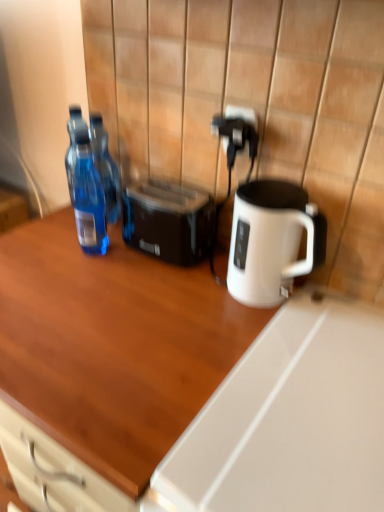
Question: Does wooden desk at center have a lesser height compared to black plastic toaster at center?

Choices:
 (A) no
 (B) yes

Answer: (A)

Question: Is wooden desk at center surrounding black plastic toaster at center?

Choices:
 (A) yes
 (B) no

Answer: (B)

Question: Is wooden desk at center in front of black plastic toaster at center?

Choices:
 (A) no
 (B) yes

Answer: (B)

Question: Is black plastic toaster at center at the back of wooden desk at center?

Choices:
 (A) yes
 (B) no

Answer: (B)

Question: Considering the relative sizes of wooden desk at center and black plastic toaster at center in the image provided, is wooden desk at center wider than black plastic toaster at center?

Choices:
 (A) no
 (B) yes

Answer: (B)

Question: Is point (168, 257) positioned closer to the camera than point (1, 356)?

Choices:
 (A) farther
 (B) closer

Answer: (A)

Question: Is black plastic toaster at center inside or outside of wooden desk at center?

Choices:
 (A) inside
 (B) outside

Answer: (B)

Question: Looking at the image, does black plastic toaster at center seem bigger or smaller compared to wooden desk at center?

Choices:
 (A) big
 (B) small

Answer: (B)

Question: From a real-world perspective, is black plastic toaster at center positioned above or below wooden desk at center?

Choices:
 (A) below
 (B) above

Answer: (B)

Question: Considering the relative positions of transparent plastic bottle at left, the second bottle in the front-to-back sequence, and black plastic toaster at center in the image provided, is transparent plastic bottle at left, the second bottle in the front-to-back sequence, to the left or to the right of black plastic toaster at center?

Choices:
 (A) right
 (B) left

Answer: (B)

Question: In terms of size, does transparent plastic bottle at left, the second bottle in the front-to-back sequence, appear bigger or smaller than black plastic toaster at center?

Choices:
 (A) big
 (B) small

Answer: (B)

Question: From their relative heights in the image, would you say transparent plastic bottle at left, which ranks as the first bottle in back-to-front order, is taller or shorter than black plastic toaster at center?

Choices:
 (A) tall
 (B) short

Answer: (A)

Question: Is transparent plastic bottle at left, which ranks as the first bottle in back-to-front order, in front of or behind black plastic toaster at center in the image?

Choices:
 (A) behind
 (B) front

Answer: (A)

Question: Would you say transparent plastic bottle at left, which ranks as the first bottle in back-to-front order, is inside or outside wooden desk at center?

Choices:
 (A) outside
 (B) inside

Answer: (A)

Question: Considering the relative positions of transparent plastic bottle at left, the second bottle in the front-to-back sequence, and wooden desk at center in the image provided, is transparent plastic bottle at left, the second bottle in the front-to-back sequence, to the left or to the right of wooden desk at center?

Choices:
 (A) right
 (B) left

Answer: (B)